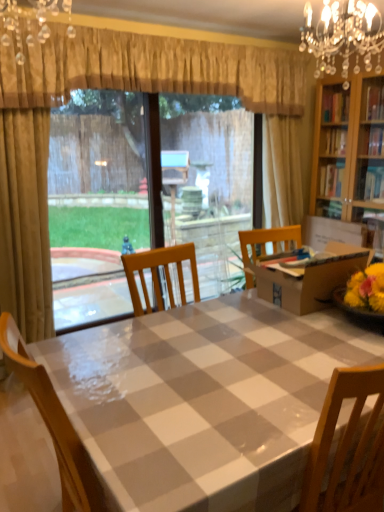
What are the coordinates of `blank space situated above checkered plastic table at center (from a real-world perspective)` in the screenshot? It's located at (238, 353).